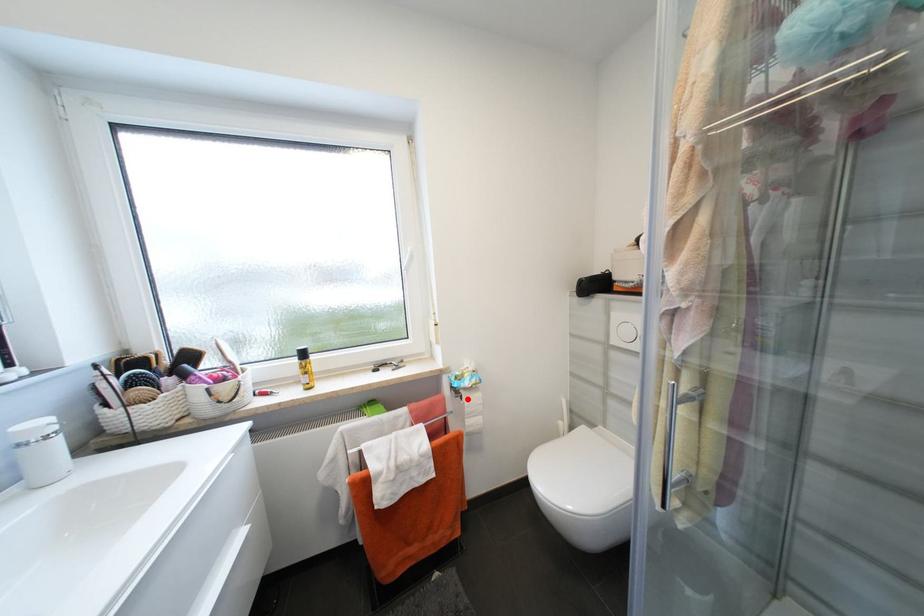
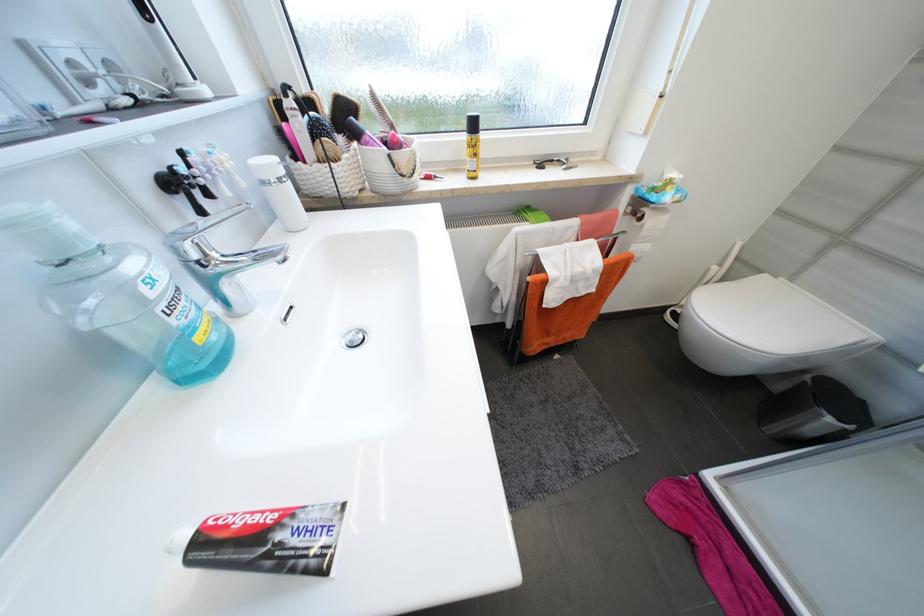
In the second image, find the point that corresponds to the highlighted location in the first image.

(647, 219)